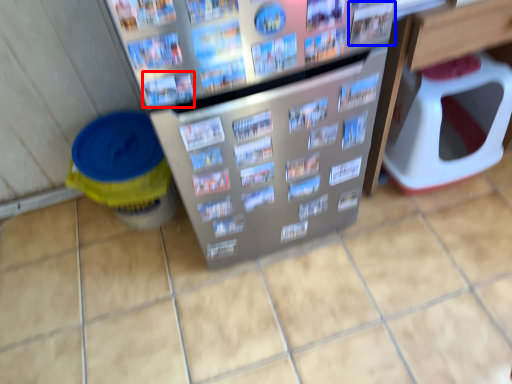
Question: Which object is closer to the camera taking this photo, magazine (highlighted by a red box) or magazine (highlighted by a blue box)?

Choices:
 (A) magazine
 (B) magazine

Answer: (A)